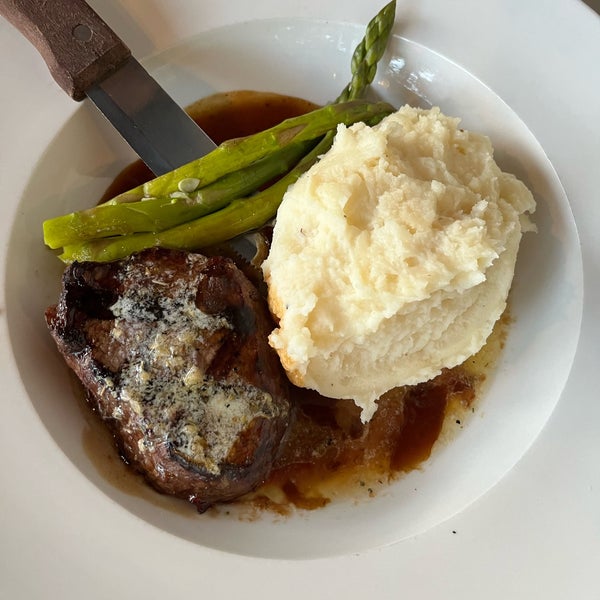
Find the location of a particular element. white background, countertop is located at coordinates (561, 480).